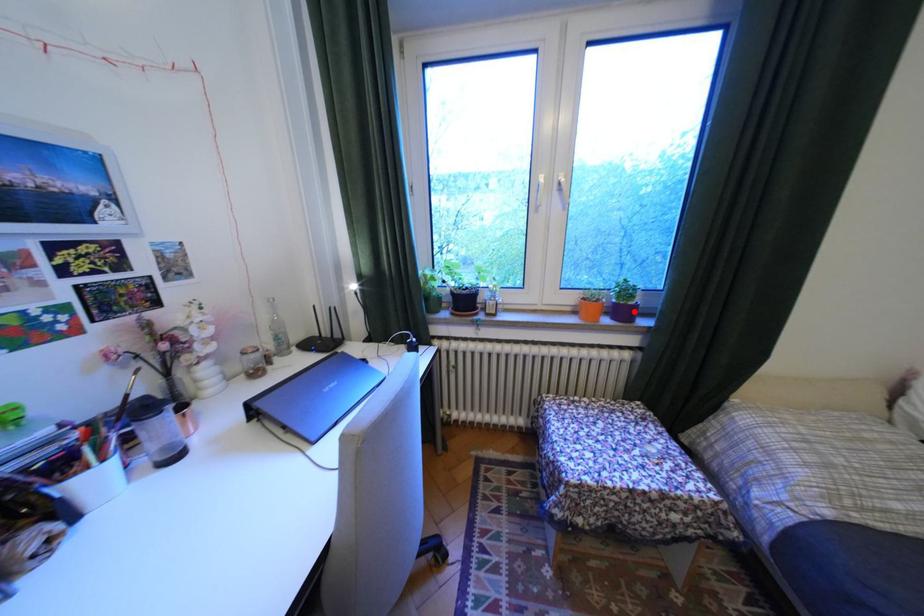
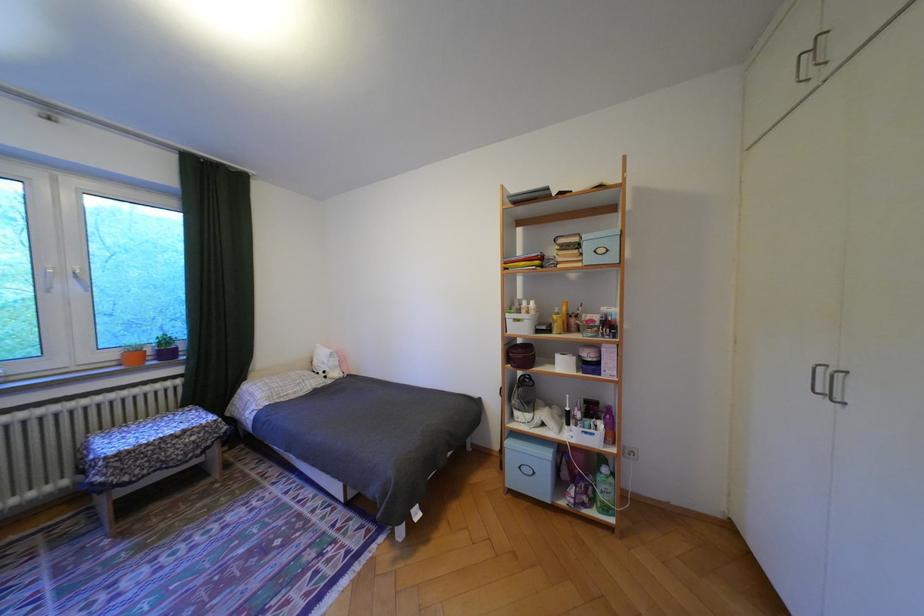
Where in the second image is the point corresponding to the highlighted location from the first image?

(178, 354)